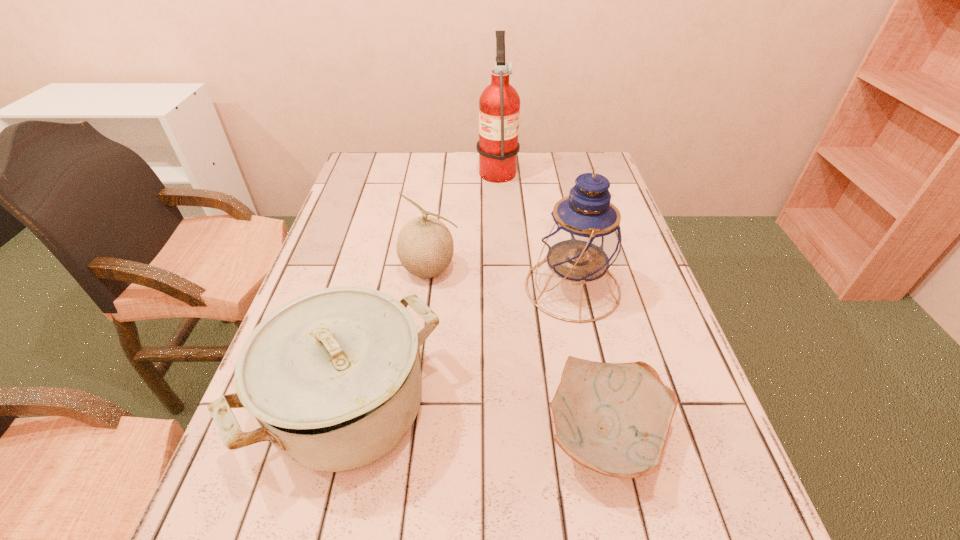
Find the location of a particular element. Image resolution: width=960 pixels, height=540 pixels. free location at the left edge of the desktop is located at coordinates (348, 225).

Where is `free region at the right edge of the desktop`? This screenshot has width=960, height=540. free region at the right edge of the desktop is located at coordinates (598, 281).

Image resolution: width=960 pixels, height=540 pixels. Identify the location of vacant region at the far left corner. (391, 152).

Image resolution: width=960 pixels, height=540 pixels. I want to click on blank region between the saucepan and the lantern, so click(462, 347).

I want to click on free area in between the pottery and the fire extinguisher, so click(x=551, y=302).

Where is `free spot between the lantern and the fire extinguisher`? The width and height of the screenshot is (960, 540). free spot between the lantern and the fire extinguisher is located at coordinates (535, 228).

You are a GUI agent. You are given a task and a screenshot of the screen. Output one action in this format:
    pyautogui.click(x=<x>, y=<y>)
    Task: Click on the vacant area between the fire extinguisher and the cantaloup
    
    Given the screenshot: What is the action you would take?
    pyautogui.click(x=464, y=219)

Locate an element on the screen. The height and width of the screenshot is (540, 960). unoccupied area between the cantaloup and the shortest object is located at coordinates (517, 353).

At what (x,y) coordinates should I click in order to perform the action: click on vacant point located between the fourth shortest object and the fire extinguisher. Please return your answer as a coordinate pair (x, y). Image resolution: width=960 pixels, height=540 pixels. Looking at the image, I should click on (535, 228).

Image resolution: width=960 pixels, height=540 pixels. Find the location of `free space between the fire extinguisher and the pottery`. free space between the fire extinguisher and the pottery is located at coordinates (551, 302).